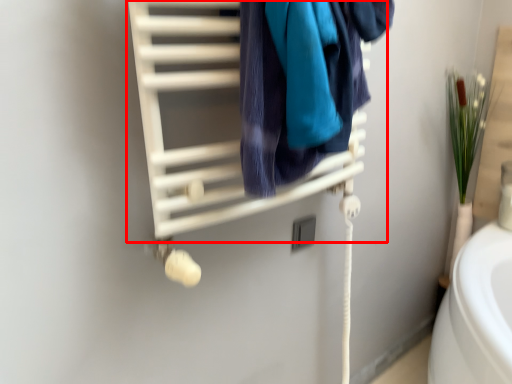
Question: From the image's perspective, considering the relative positions of closet (annotated by the red box) and towel in the image provided, where is closet (annotated by the red box) located with respect to the staircase?

Choices:
 (A) below
 (B) above

Answer: (A)